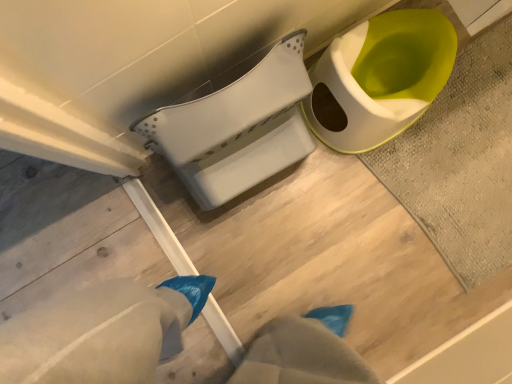
Find the location of a particular element. The height and width of the screenshot is (384, 512). free point below textured gray bath mat at upper right (from a real-world perspective) is located at coordinates pyautogui.click(x=463, y=166).